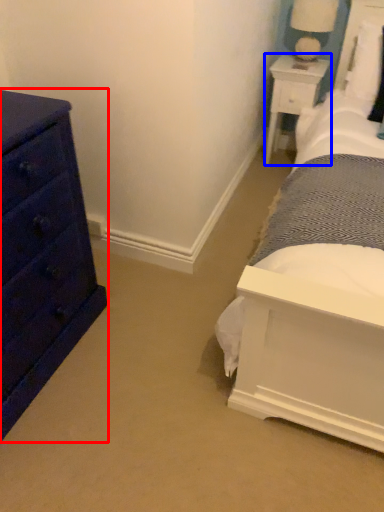
Question: Which point is closer to the camera, chest of drawers (highlighted by a red box) or nightstand (highlighted by a blue box)?

Choices:
 (A) chest of drawers
 (B) nightstand

Answer: (A)